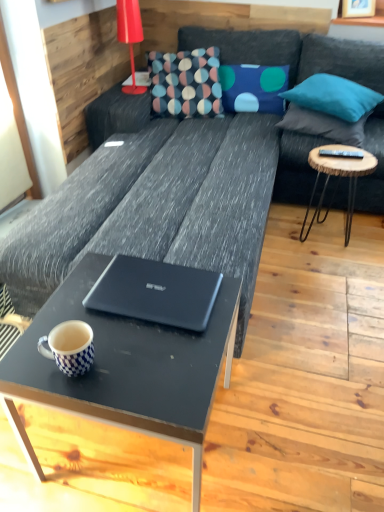
Where is `empty space that is ontop of matte black coffee table at center`? The image size is (384, 512). empty space that is ontop of matte black coffee table at center is located at coordinates (135, 328).